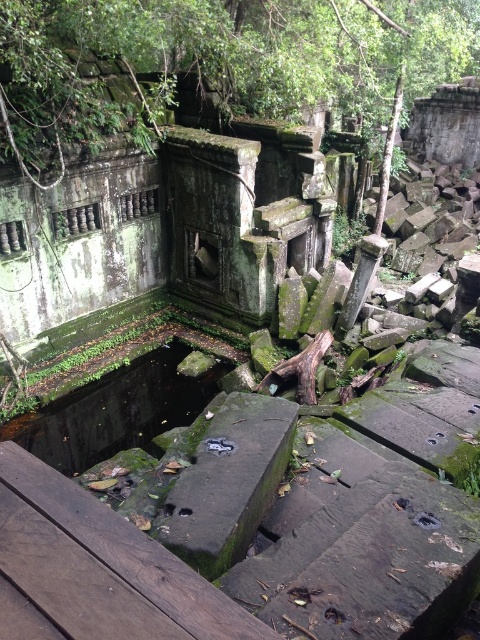
Question: Observing the image, what is the correct spatial positioning of brown wooden plank at lower left in reference to green mossy stone at center?

Choices:
 (A) below
 (B) above

Answer: (B)

Question: Which point is closer to the camera?

Choices:
 (A) (49, 451)
 (B) (34, 54)

Answer: (B)

Question: Does green mossy stone at upper center have a larger size compared to brown wooden plank at lower left?

Choices:
 (A) yes
 (B) no

Answer: (A)

Question: Which point is closer to the camera taking this photo?

Choices:
 (A) (208, 397)
 (B) (7, 452)

Answer: (B)

Question: Among these objects, which one is nearest to the camera?

Choices:
 (A) green mossy stone at center
 (B) green mossy stone at upper center

Answer: (B)

Question: Is green mossy stone at upper center thinner than brown wooden plank at lower left?

Choices:
 (A) yes
 (B) no

Answer: (B)